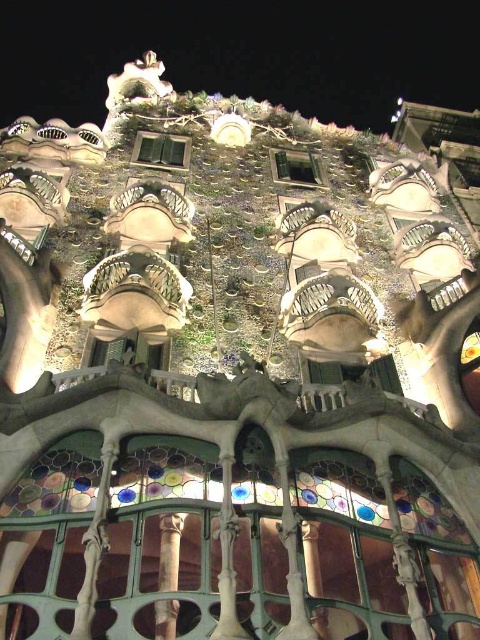
Question: Which object is closer to the camera taking this photo?

Choices:
 (A) brown wood column at center
 (B) clear glass window at upper center
 (C) matte glass window at center

Answer: (A)

Question: Is stained glass balcony at upper center smaller than brown wood column at center?

Choices:
 (A) no
 (B) yes

Answer: (A)

Question: In this image, where is stained glass balcony at upper center located relative to matte glass window at center?

Choices:
 (A) above
 (B) below

Answer: (A)

Question: Is matte glass window at center to the right of clear glass window at upper center from the viewer's perspective?

Choices:
 (A) no
 (B) yes

Answer: (A)

Question: Which of the following is the farthest from the observer?

Choices:
 (A) (296, 173)
 (B) (149, 164)

Answer: (A)

Question: Which point is closer to the camera taking this photo?

Choices:
 (A) (456, 48)
 (B) (169, 540)

Answer: (B)